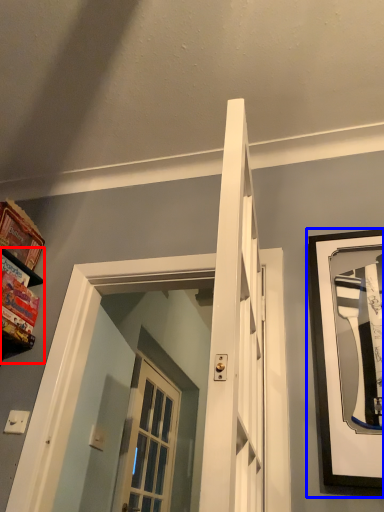
Question: Which object is further to the camera taking this photo, shelf (highlighted by a red box) or picture frame (highlighted by a blue box)?

Choices:
 (A) shelf
 (B) picture frame

Answer: (A)